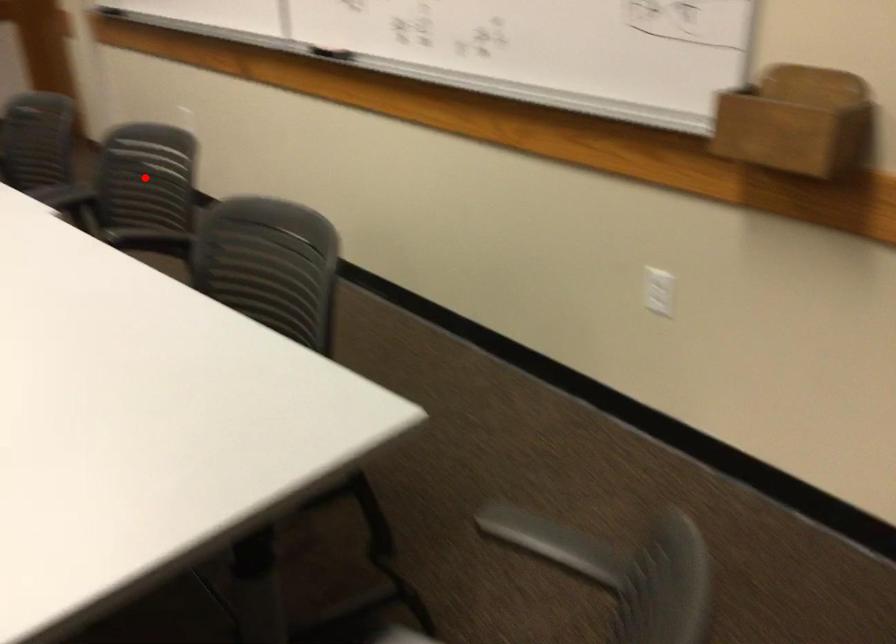
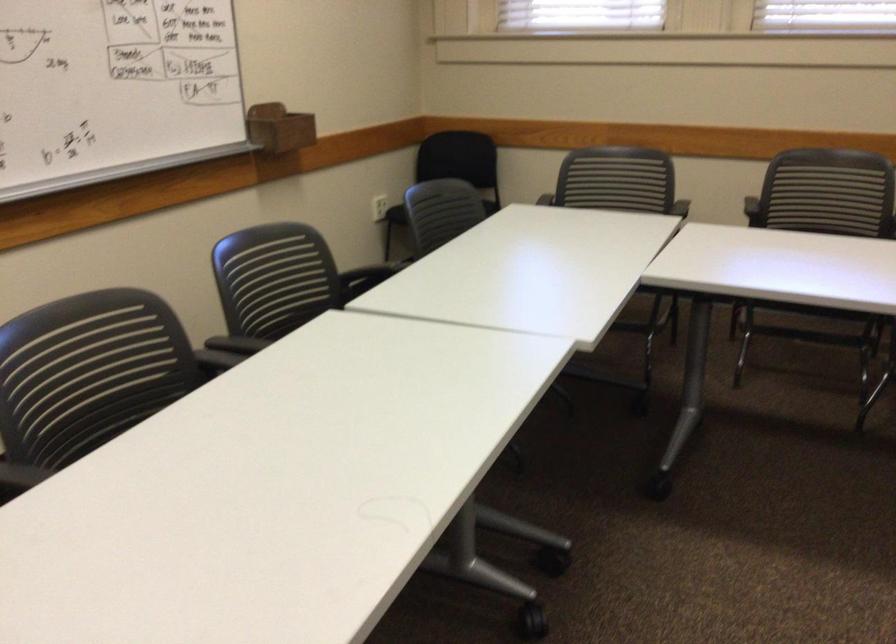
Question: I am providing you with two images of the same scene from different viewpoints. A red point is marked on the first image. Can you still see the location of the red point in image 2?

Choices:
 (A) Yes
 (B) No

Answer: (B)